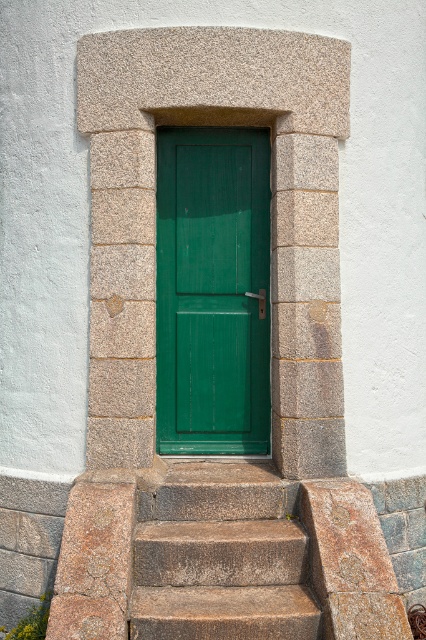
Consider the image. You are standing in front of the green wooden door at center and want to open it. If your arm can reach up to 16 feet, can you reach the door handle without moving closer?

The green wooden door at center is 17.68 feet away from you, which is beyond your arm reach of 16 feet. Therefore, you cannot reach the door handle without moving closer.

You are a painter who needs to paint both the green wooden door at center and the granite steps at center. Which object requires more paint because it has a larger surface area?

The granite steps at center require more paint because they are larger than the green wooden door at center.

You are standing in front of the green wooden door at center and want to enter the building. However, you notice granite steps at center in front of you. Which direction should you move to reach the door first?

The green wooden door at center is to the left of granite steps at center. To reach the door first, you should move to the left side of the granite steps at center.